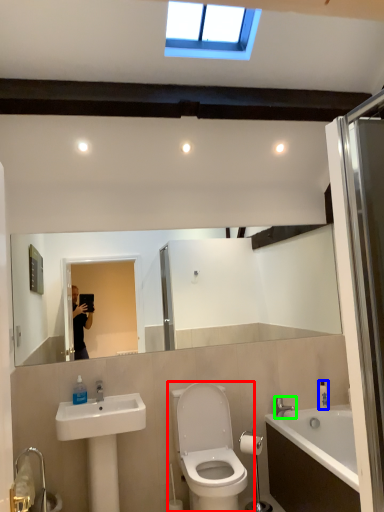
Question: Considering the real-world distances, which object is closest to toilet (highlighted by a red box)? toiletry (highlighted by a blue box) or tap (highlighted by a green box).

Choices:
 (A) toiletry
 (B) tap

Answer: (B)